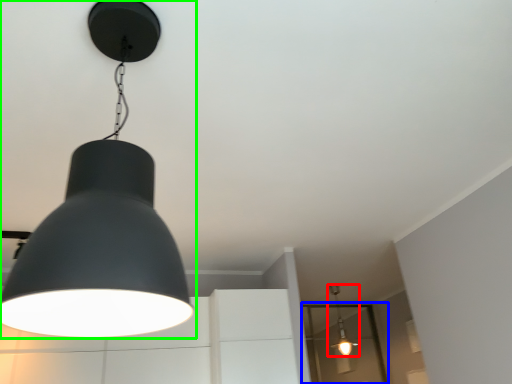
Question: Which is nearer to the lamp (highlighted by a red box)? glass door (highlighted by a blue box) or lamp (highlighted by a green box).

Choices:
 (A) glass door
 (B) lamp

Answer: (A)